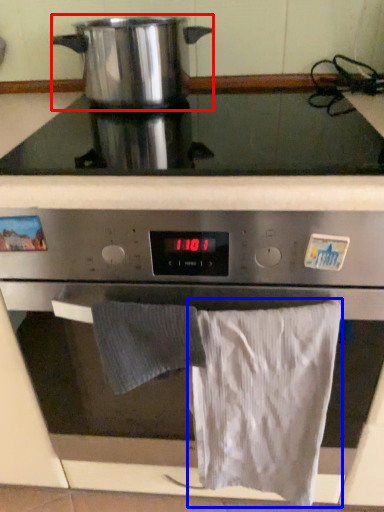
Question: Which object appears closest to the camera in this image, kitchen appliance (highlighted by a red box) or bath towel (highlighted by a blue box)?

Choices:
 (A) kitchen appliance
 (B) bath towel

Answer: (B)